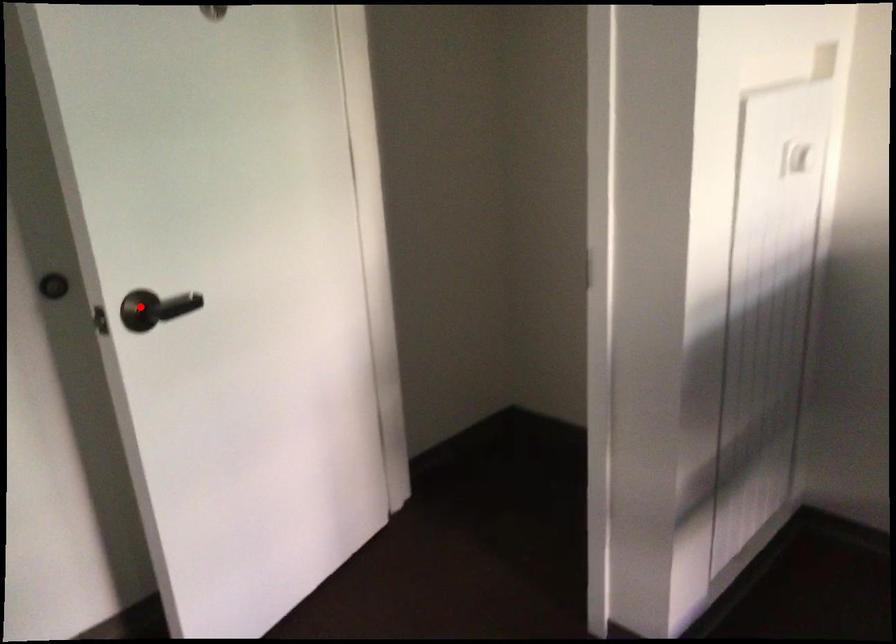
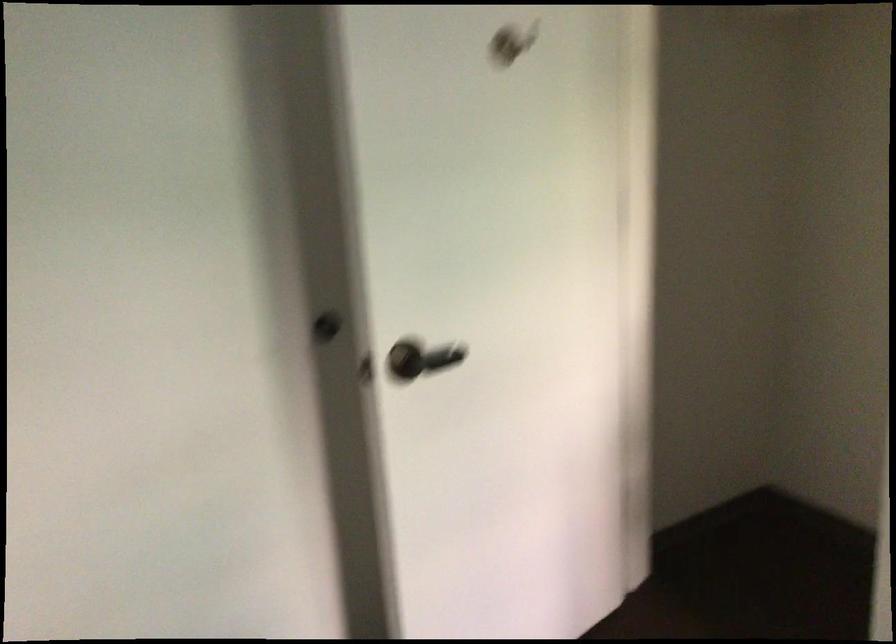
Find the pixel in the second image that matches the highlighted location in the first image.

(407, 359)